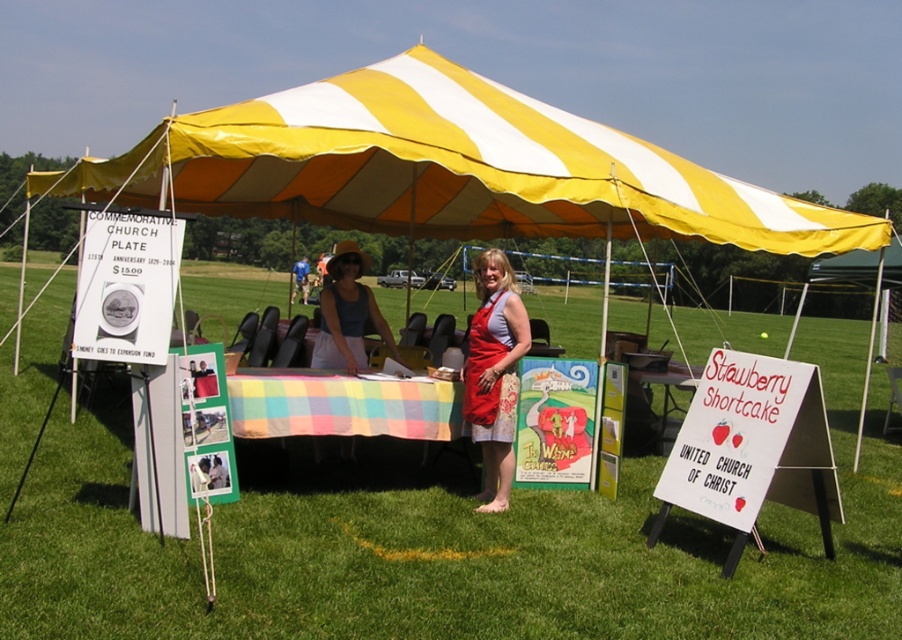
You are at the event and want to place a new dish on the table. The dish needs to be placed to the right of the red apron at center. Will it end up on the plaid fabric table at center?

Yes, because the red apron at center is to the left of the plaid fabric table at center, placing the dish to the right of the red apron at center would position it on the plaid fabric table at center.

You are organizing a picnic and need to decide whether your red apron at center can fit on the plaid fabric table at center. Can it be placed there without overlapping the edges?

The red apron at center is smaller than the plaid fabric table at center, so it can be placed on the table without overlapping the edges.

Looking at this image, you are organizing a community event and need to decide whether the matte gray tank top at center can be hung on a thin hanger. Based on the description, can it fit on the hanger if the hanger is as thin as the plaid fabric table at center?

The matte gray tank top at center is thinner than the plaid fabric table at center. If the hanger is as thin as the plaid fabric table at center, the matte gray tank top at center would be thinner and thus can fit on the hanger.